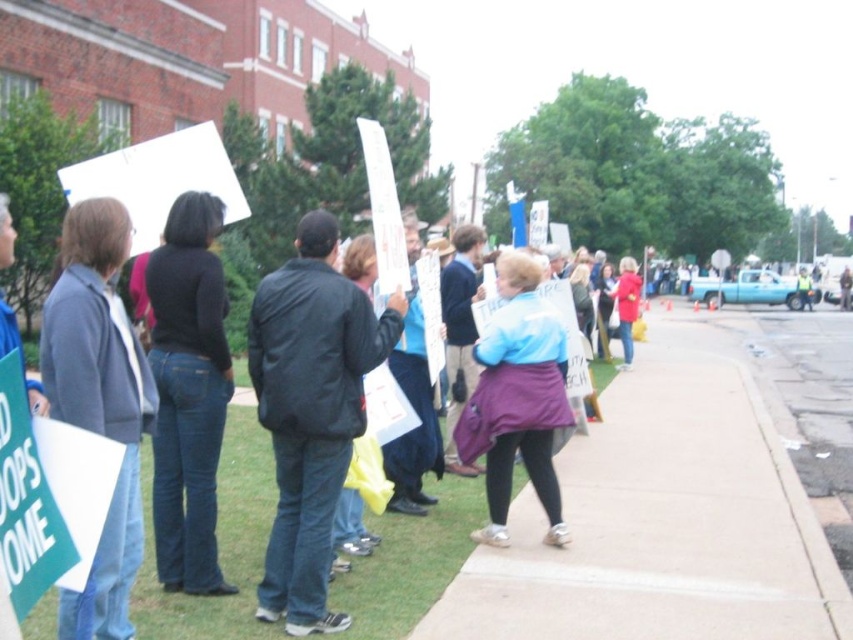
Question: Which point is farther from the camera taking this photo?

Choices:
 (A) (549, 616)
 (B) (531, 440)

Answer: (B)

Question: Considering the real-world distances, which object is farthest from the matte black jacket at center?

Choices:
 (A) purple fabric coat at center
 (B) paved concrete sidewalk at center
 (C) black leather jacket at center

Answer: (B)

Question: Can you confirm if gray wool sweater at left is positioned to the left of purple fabric coat at center?

Choices:
 (A) no
 (B) yes

Answer: (B)

Question: Which of the following is the farthest from the observer?

Choices:
 (A) black leather jacket at center
 (B) paved concrete sidewalk at center
 (C) gray wool sweater at left
 (D) matte black jacket at center

Answer: (D)

Question: Is paved concrete sidewalk at center below black leather jacket at center?

Choices:
 (A) no
 (B) yes

Answer: (B)

Question: Does paved concrete sidewalk at center have a lesser width compared to gray wool sweater at left?

Choices:
 (A) no
 (B) yes

Answer: (A)